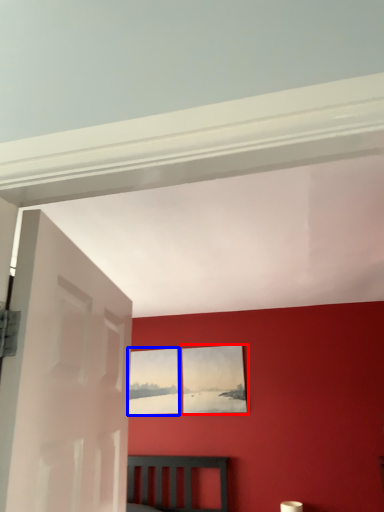
Question: Which of the following is the closest to the observer, picture frame (highlighted by a red box) or picture frame (highlighted by a blue box)?

Choices:
 (A) picture frame
 (B) picture frame

Answer: (A)